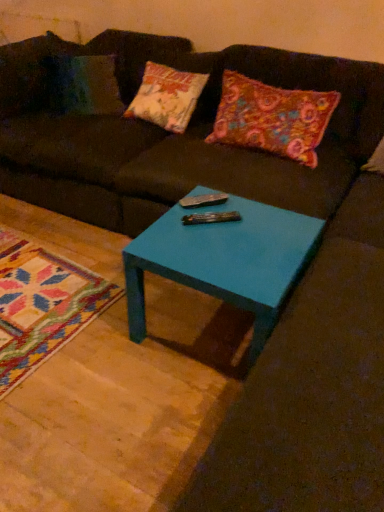
The image size is (384, 512). In order to click on vacant area that is in front of teal glossy table at center in this screenshot , I will do `click(152, 425)`.